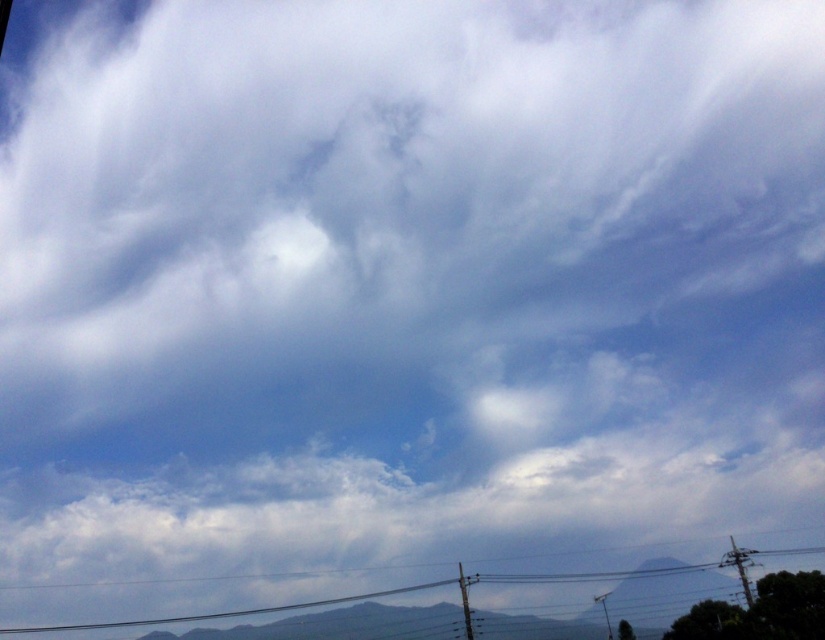
Can you confirm if black wire at bottom is thinner than metallic gray pole at lower center?

No, black wire at bottom is not thinner than metallic gray pole at lower center.

Which is behind, point (719, 561) or point (469, 609)?

Point (719, 561)

Identify the location of black wire at bottom. (227, 611).